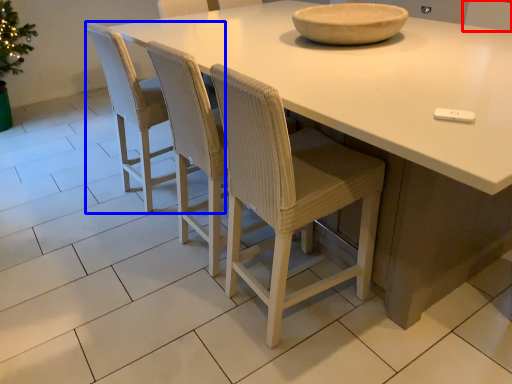
Question: Which point is further to the camera, chair (highlighted by a red box) or chair (highlighted by a blue box)?

Choices:
 (A) chair
 (B) chair

Answer: (A)